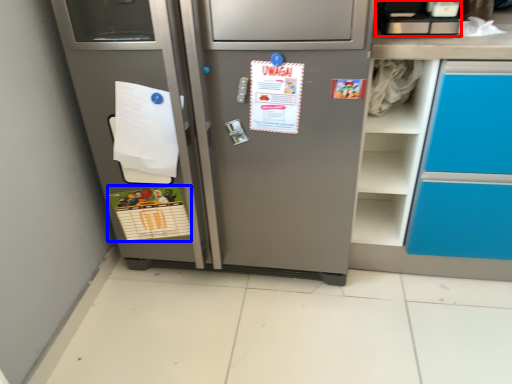
Question: Which object appears closest to the camera in this image, appliance (highlighted by a red box) or postcard (highlighted by a blue box)?

Choices:
 (A) appliance
 (B) postcard

Answer: (A)